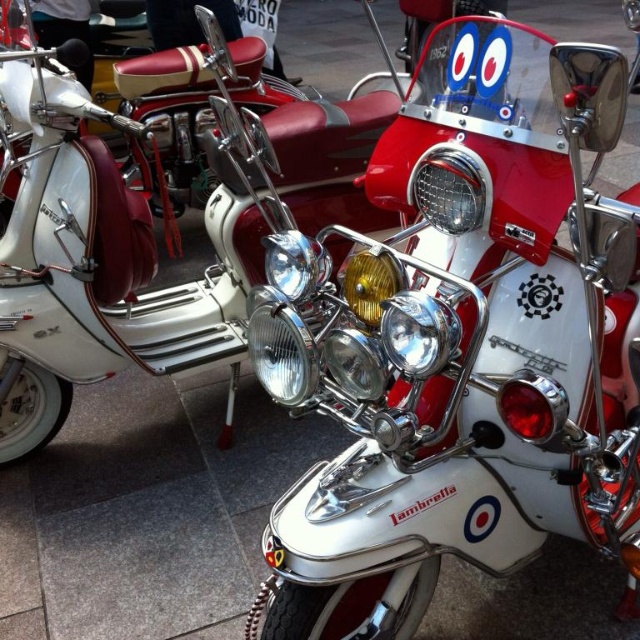
You are a delivery person who needs to move a 30 inch wide box between the white chrome lambretta at center and the white chrome scooter at center. Can the box fit through the space between them?

The white chrome lambretta at center and white chrome scooter at center are 28.24 inches apart from each other. Since the box is 30 inches wide, it cannot fit through the space between them.

You are a delivery person who needs to fit both the white chrome lambretta at center and the white chrome scooter at center into a storage container that can only accommodate items up to the width of the wider scooter. Which scooter should you place first to ensure both fit?

The white chrome lambretta at center is thinner than the white chrome scooter at center, so you should place the wider white chrome scooter at center first to ensure both fit within the container.

You are a photographer setting up a shot of the two scooters. You want to ensure that the white chrome lambretta at center is positioned lower in the frame than the white chrome scooter at center. Based on the scene description, is this already the case?

Yes, the white chrome lambretta at center is positioned below the white chrome scooter at center, so it already meets your requirement.